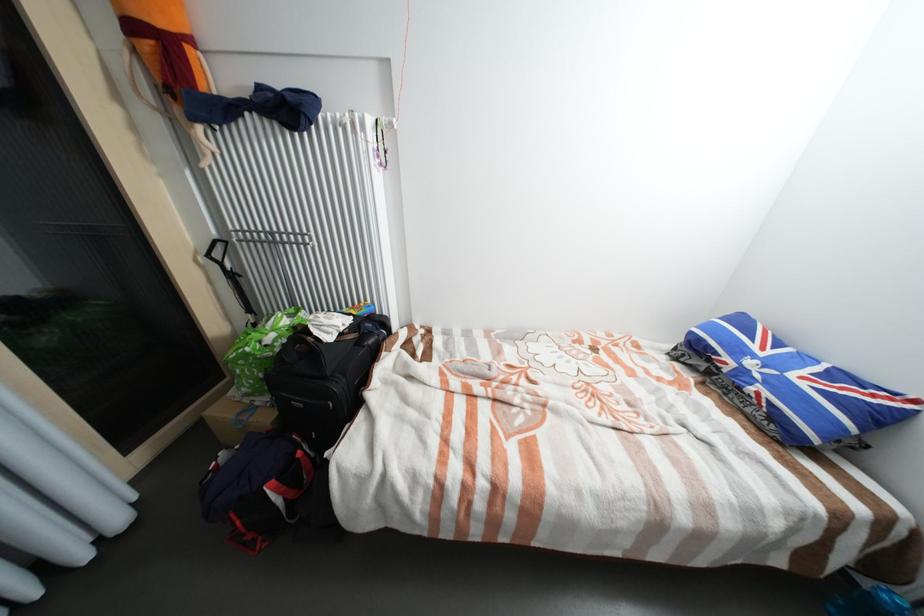
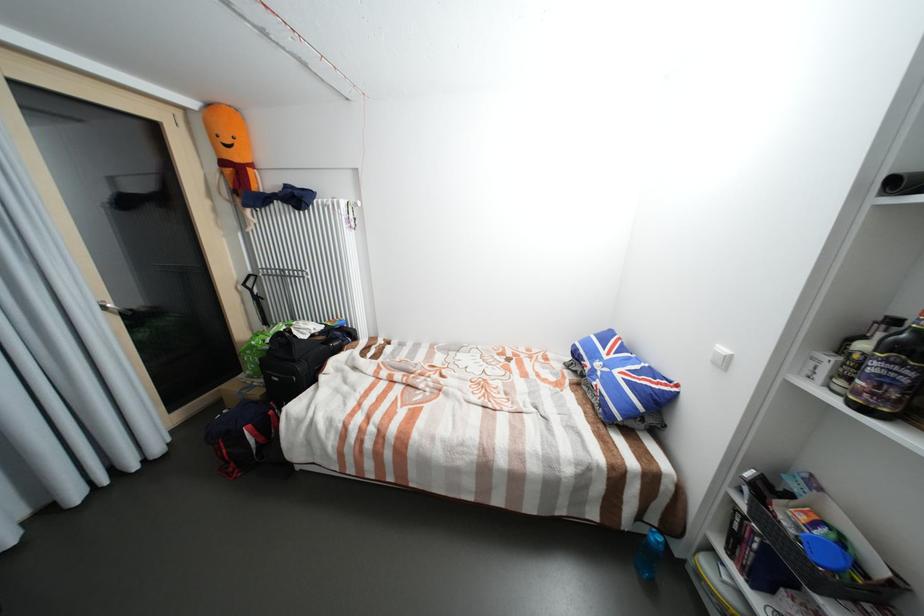
Find the pixel in the second image that matches [139,28] in the first image.

(229, 163)